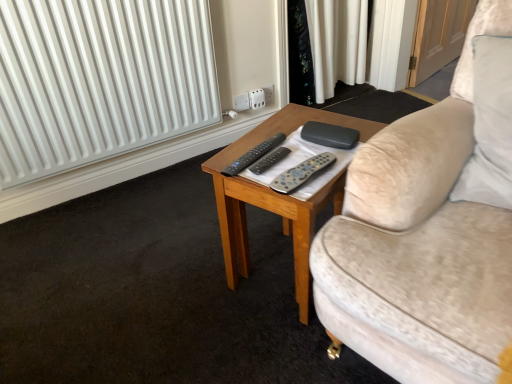
Image resolution: width=512 pixels, height=384 pixels. Identify the location of free region on the left part of wooden coffee table at center. (184, 278).